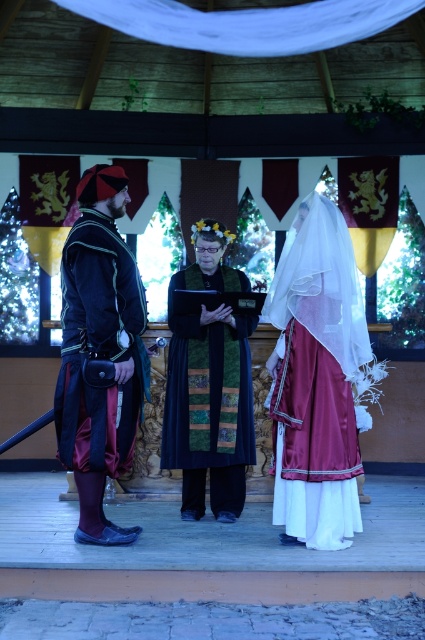
You are an attendee at this medieval event and want to approach the velvet dark blue dress at center and the velvet dark blue tunic at left. Which one should you walk towards first if you want to reach the one closer to you first?

The velvet dark blue dress at center is closer to you than the velvet dark blue tunic at left, so you should walk towards the velvet dark blue dress at center first.

Consider the image. You are observing a medieval ceremony and notice two attendees wearing velvet dark blue clothing. The velvet dark blue dress at center and the velvet dark blue tunic at left. Based on their positions, which one is standing to the right of the other?

The velvet dark blue dress at center is to the right of the velvet dark blue tunic at left.